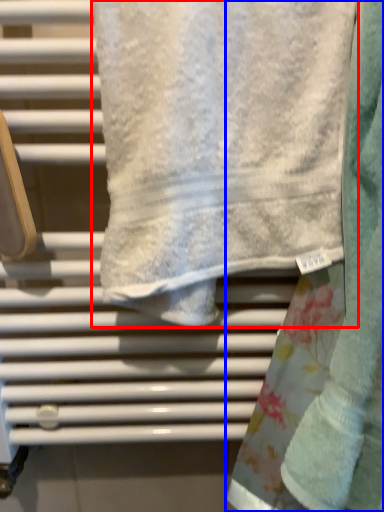
Question: Among these objects, which one is nearest to the camera, towel (highlighted by a red box) or towel (highlighted by a blue box)?

Choices:
 (A) towel
 (B) towel

Answer: (B)